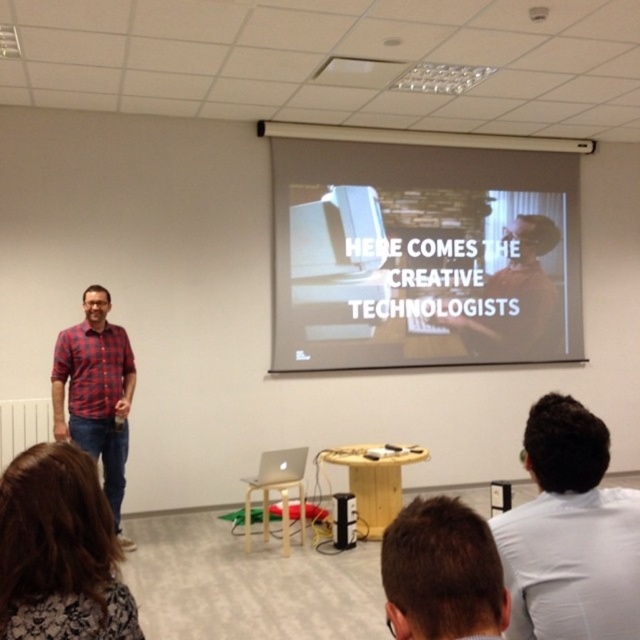
You are standing in the presentation room and see the point at coordinates (570, 532). According to the image, what object is located at that point?

The point at coordinates (570, 532) is located on the white shirt at upper right.

You are an attendee sitting in the front row and want to take a photo of the white matte projector screen at upper center and the white shirt at upper right. Which object should you focus on first if you want to capture both in a single frame without moving your camera?

The white matte projector screen at upper center is wider than the white shirt at upper right, so you should focus on the white matte projector screen at upper center first to ensure it fits properly in the frame before adjusting for the smaller white shirt at upper right.